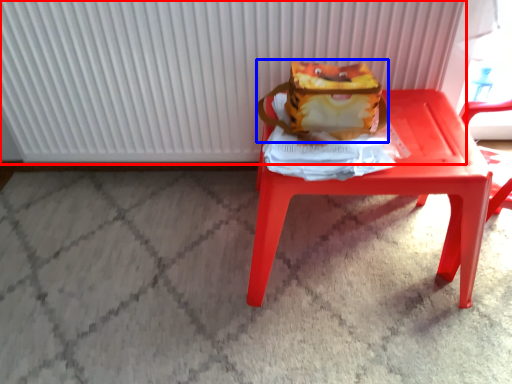
Question: Which of the following is the closest to the observer, radiator (highlighted by a red box) or shoulder bag (highlighted by a blue box)?

Choices:
 (A) radiator
 (B) shoulder bag

Answer: (B)